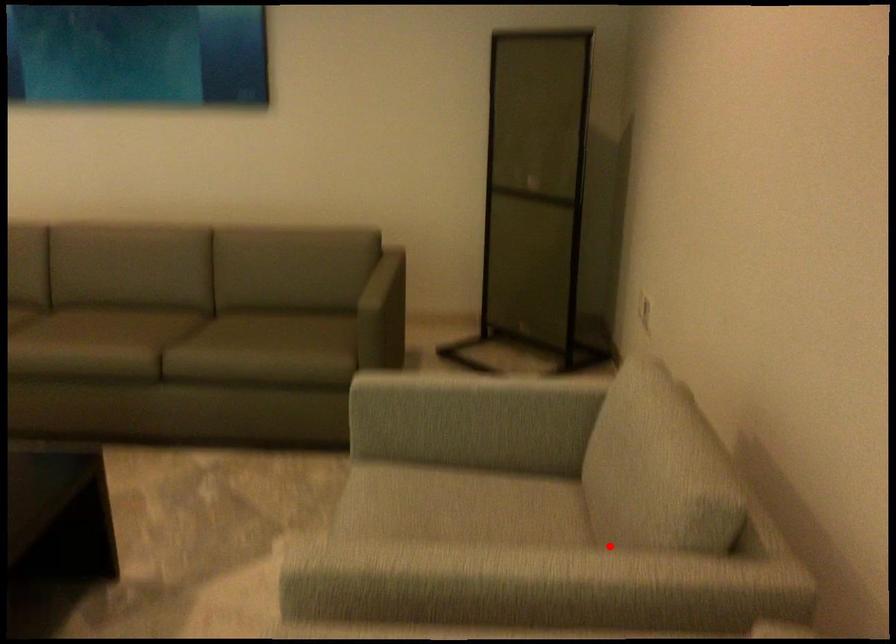
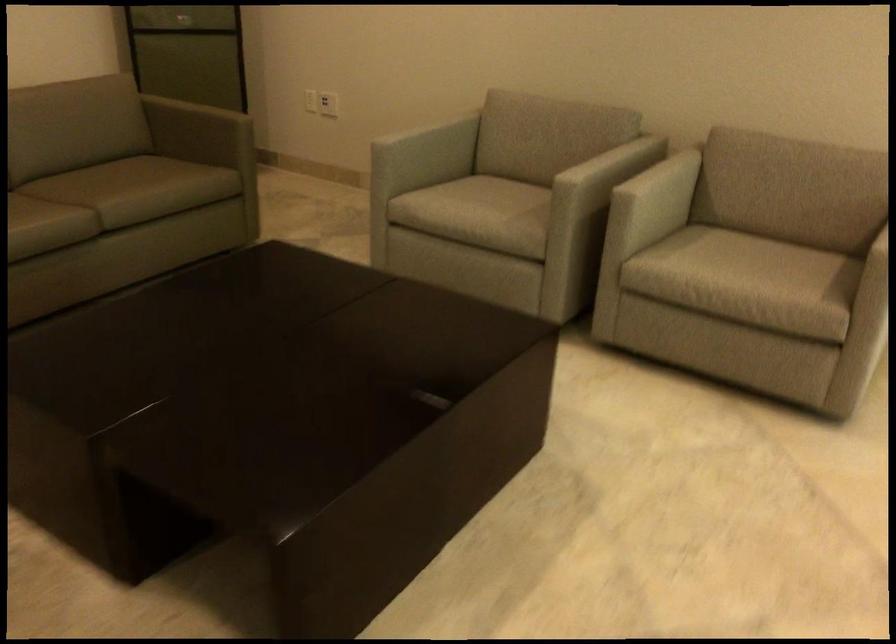
Question: I am providing you with two images of the same scene from different viewpoints. In image1, a red point is highlighted. Considering the same 3D point in image2, which of the following is correct?

Choices:
 (A) It is closer
 (B) It is farther

Answer: (B)